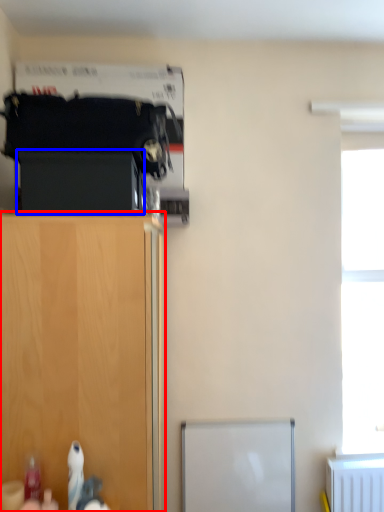
Question: Which object appears farthest to the camera in this image, cupboard (highlighted by a red box) or cabinetry (highlighted by a blue box)?

Choices:
 (A) cupboard
 (B) cabinetry

Answer: (B)